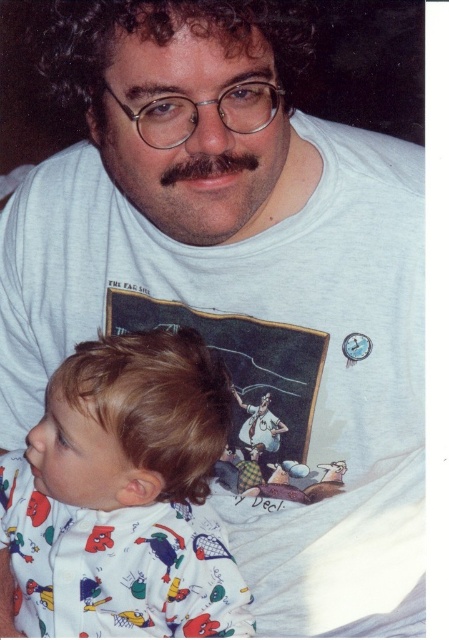
Question: Which point appears closest to the camera in this image?

Choices:
 (A) (136, 161)
 (B) (188, 620)

Answer: (A)

Question: Is white cotton onesie at lower left thinner than dark brown hair at center?

Choices:
 (A) no
 (B) yes

Answer: (A)

Question: Is white cotton onesie at lower left wider than dark brown hair at center?

Choices:
 (A) yes
 (B) no

Answer: (A)

Question: Is white cotton onesie at lower left smaller than dark brown hair at center?

Choices:
 (A) no
 (B) yes

Answer: (A)

Question: Which point is farther from the camera taking this photo?

Choices:
 (A) (102, 536)
 (B) (114, 177)

Answer: (A)

Question: Which point is closer to the camera taking this photo?

Choices:
 (A) (96, 508)
 (B) (124, 188)

Answer: (B)